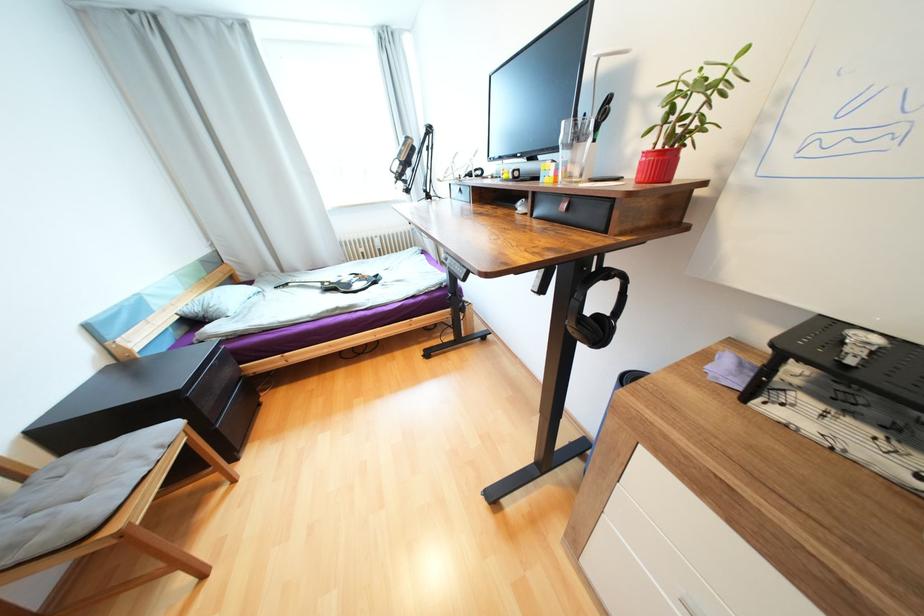
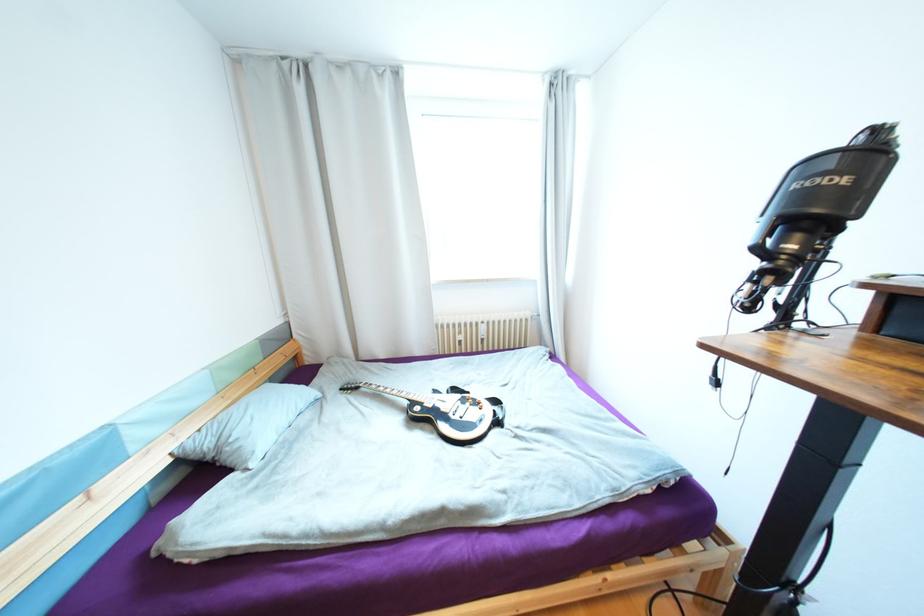
What movement of the cameraman would produce the second image?

The cameraman moved toward left, forward.